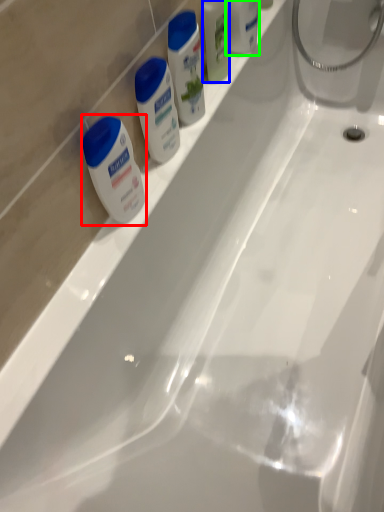
Question: Considering the real-world distances, which object is farthest from shaving cream (highlighted by a red box)? mouthwash (highlighted by a blue box) or toiletry (highlighted by a green box)?

Choices:
 (A) mouthwash
 (B) toiletry

Answer: (B)